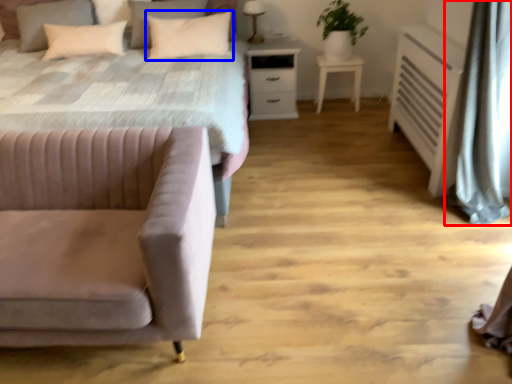
Question: Which object appears closest to the camera in this image, curtain (highlighted by a red box) or pillow (highlighted by a blue box)?

Choices:
 (A) curtain
 (B) pillow

Answer: (A)